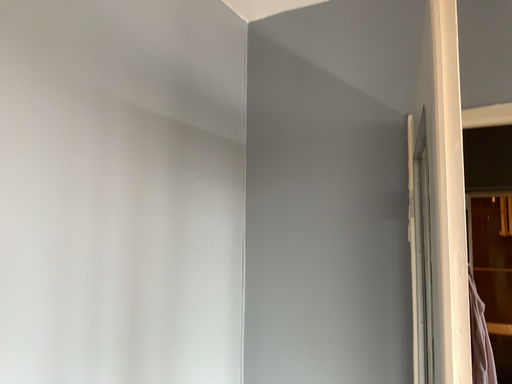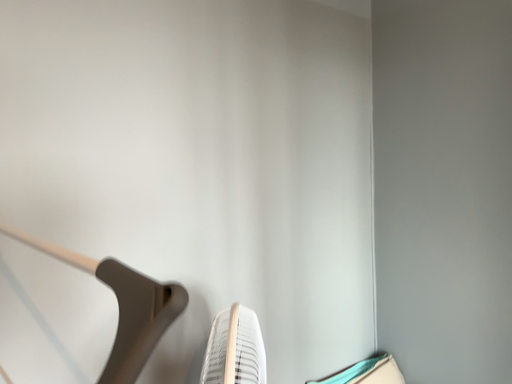
Question: How did the camera likely rotate when shooting the video?

Choices:
 (A) rotated upward
 (B) rotated downward

Answer: (B)